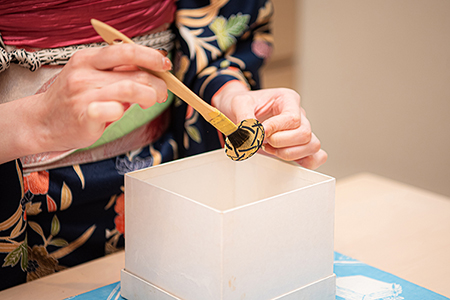
Find the location of a particular element. The image size is (450, 300). box is located at coordinates (197, 229).